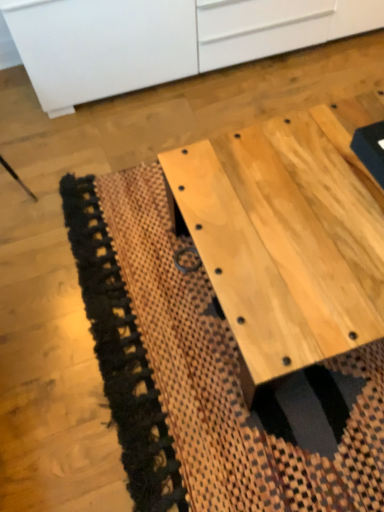
At what (x,y) coordinates should I click in order to perform the action: click on natural woven mat at center. Please return your answer as a coordinate pair (x, y). Image resolution: width=384 pixels, height=512 pixels. Looking at the image, I should click on (210, 376).

Measure the distance between natural woven mat at center and camera.

The distance of natural woven mat at center from camera is 37.94 inches.

Find the location of `white matte cabinet at upper center`. white matte cabinet at upper center is located at coordinates (x=167, y=38).

Is white matte cabinet at upper center to the left of natural woven mat at center from the viewer's perspective?

Indeed, white matte cabinet at upper center is positioned on the left side of natural woven mat at center.

Which is in front, point (295, 47) or point (212, 404)?

Point (212, 404)

From a real-world perspective, is white matte cabinet at upper center beneath natural woven mat at center?

No, from a real-world perspective, white matte cabinet at upper center is not beneath natural woven mat at center.

Between natural wood table at center and white matte cabinet at upper center, which one appears on the left side from the viewer's perspective?

From the viewer's perspective, white matte cabinet at upper center appears more on the left side.

From a real-world perspective, is natural wood table at center physically located above or below white matte cabinet at upper center?

From a real-world perspective, natural wood table at center is physically below white matte cabinet at upper center.

Considering the sizes of objects natural wood table at center and white matte cabinet at upper center in the image provided, who is wider, natural wood table at center or white matte cabinet at upper center?

With larger width is natural wood table at center.

Measure the distance between white matte cabinet at upper center and natural wood table at center.

white matte cabinet at upper center is 33.34 inches from natural wood table at center.

Based on their positions, is white matte cabinet at upper center located to the left or right of natural wood table at center?

white matte cabinet at upper center is to the left of natural wood table at center.

Which is more distant, (205, 3) or (319, 236)?

Point (205, 3)

Looking at this image, which of these two, white matte cabinet at upper center or natural wood table at center, is wider?

natural wood table at center.

From a real-world perspective, who is located higher, natural woven mat at center or white matte cabinet at upper center?

From a 3D spatial view, white matte cabinet at upper center is above.

Considering the sizes of objects natural woven mat at center and white matte cabinet at upper center in the image provided, who is wider, natural woven mat at center or white matte cabinet at upper center?

natural woven mat at center.

Can you confirm if natural woven mat at center is positioned to the right of white matte cabinet at upper center?

Yes.

Is natural woven mat at center situated inside white matte cabinet at upper center or outside?

natural woven mat at center is located beyond the bounds of white matte cabinet at upper center.

Is natural woven mat at center inside the boundaries of natural wood table at center, or outside?

natural woven mat at center is not inside natural wood table at center, it's outside.

Who is taller, natural woven mat at center or natural wood table at center?

natural wood table at center.

From the image's perspective, is natural woven mat at center beneath natural wood table at center?

Yes, from the image's perspective, natural woven mat at center is beneath natural wood table at center.

Is the depth of natural woven mat at center greater than that of natural wood table at center?

Yes, natural woven mat at center is behind natural wood table at center.

Is natural wood table at center not near natural woven mat at center?

Actually, natural wood table at center and natural woven mat at center are a little close together.

Can you confirm if natural wood table at center is shorter than natural woven mat at center?

No, natural wood table at center is not shorter than natural woven mat at center.

Is natural wood table at center wider than natural woven mat at center?

Incorrect, the width of natural wood table at center does not surpass that of natural woven mat at center.

Between point (337, 154) and point (208, 311), which one is positioned behind?

Positioned behind is point (208, 311).

I want to click on mat below the white matte cabinet at upper center (from the image's perspective), so click(210, 376).

At what (x,y) coordinates should I click in order to perform the action: click on cabinetry above the natural wood table at center (from the image's perspective). Please return your answer as a coordinate pair (x, y). This screenshot has width=384, height=512. Looking at the image, I should click on (167, 38).

Which object lies further to the anchor point natural woven mat at center, natural wood table at center or white matte cabinet at upper center?

white matte cabinet at upper center is positioned further to the anchor natural woven mat at center.

Based on their spatial positions, is natural woven mat at center or white matte cabinet at upper center closer to natural wood table at center?

The object closer to natural wood table at center is natural woven mat at center.

From the image, which object appears to be farther from natural woven mat at center, white matte cabinet at upper center or natural wood table at center?

white matte cabinet at upper center.

Based on their spatial positions, is natural wood table at center or natural woven mat at center closer to white matte cabinet at upper center?

natural wood table at center lies closer to white matte cabinet at upper center than the other object.

When comparing their distances from natural wood table at center, does white matte cabinet at upper center or natural woven mat at center seem closer?

Based on the image, natural woven mat at center appears to be nearer to natural wood table at center.

Considering their positions, is natural woven mat at center positioned further to white matte cabinet at upper center than natural wood table at center?

natural woven mat at center is positioned further to the anchor white matte cabinet at upper center.

Locate an element on the screen. The width and height of the screenshot is (384, 512). table between white matte cabinet at upper center and natural woven mat at center from top to bottom is located at coordinates (285, 238).